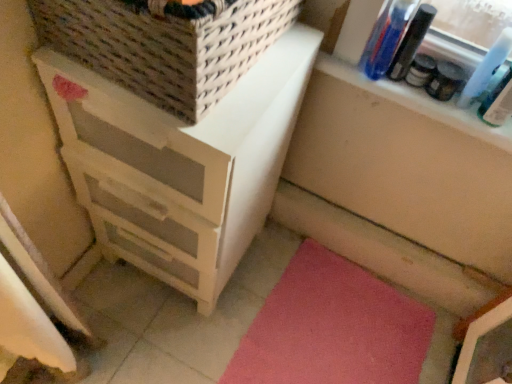
Image resolution: width=512 pixels, height=384 pixels. What are the coordinates of `blank area beneath pink carpet at lower right (from a real-world perspective)` in the screenshot? It's located at point(329,328).